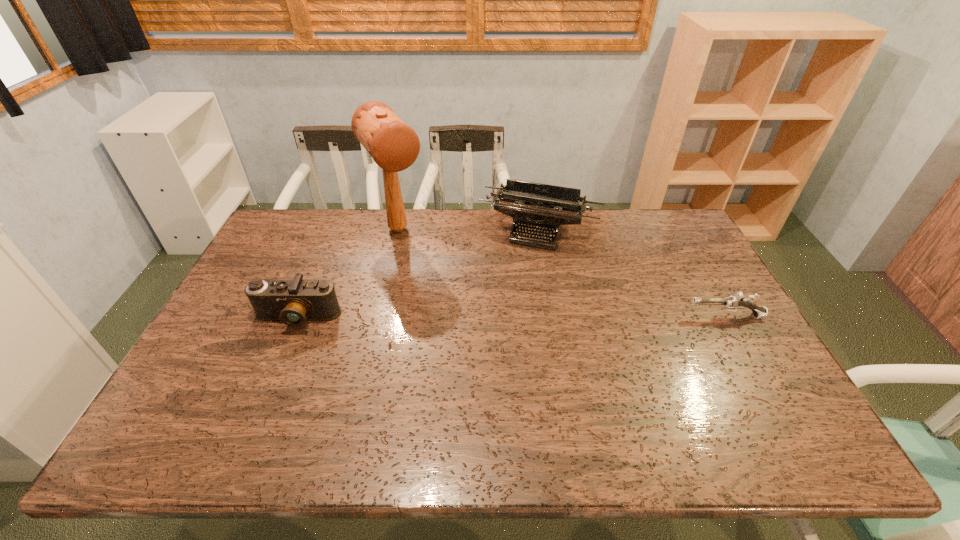
What are the coordinates of `free space on the desktop that is between the second shortest object and the rightmost object and is positioned on the typing side of the typewriter` in the screenshot? It's located at (508, 317).

I want to click on vacant space on the desktop that is between the camera and the shortest object and is positioned on the strike surface of the mallet, so click(461, 317).